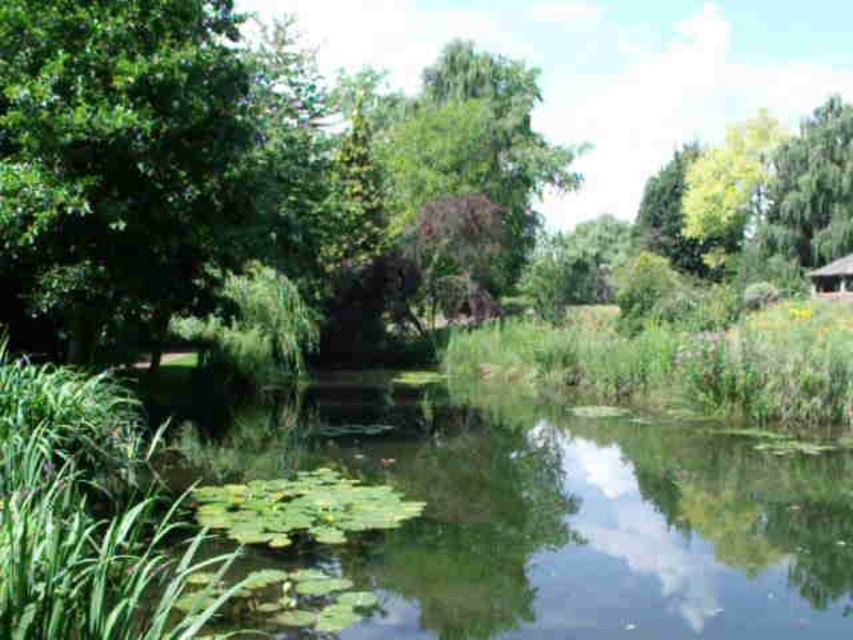
You are standing at the edge of the pond and want to locate the green leafy tree at center. According to the coordinates provided, in which direction should you look to find it?

The green leafy tree at center is located at coordinates point (120,145). Since the x coordinate is 0.228, which is less than 0.5, it is to the left of the center. The y coordinate 0.142 is below 0.5, so it is lower than the center. Therefore, you should look to the lower left direction from your current position at the edge of the pond.